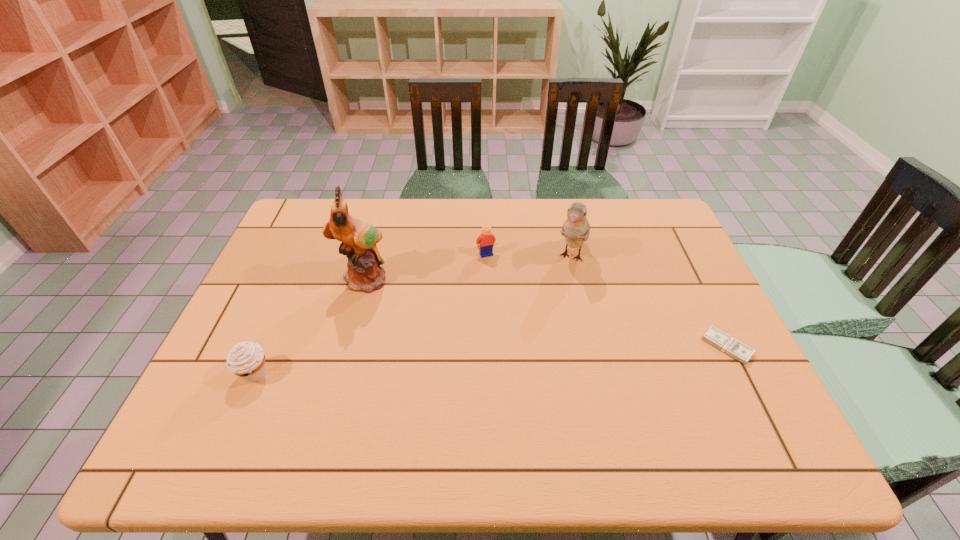
The width and height of the screenshot is (960, 540). I want to click on muffin, so click(x=246, y=359).

Identify the location of money. (739, 351).

Locate an element on the screen. The width and height of the screenshot is (960, 540). the rightmost object is located at coordinates (739, 351).

Image resolution: width=960 pixels, height=540 pixels. I want to click on the fourth object from right to left, so click(358, 238).

Where is `parrot`? parrot is located at coordinates (358, 238).

The image size is (960, 540). In order to click on bird in this screenshot , I will do `click(576, 229)`.

Locate an element on the screen. This screenshot has height=540, width=960. the second tallest object is located at coordinates (576, 229).

Where is `the third object from right to left`? The height and width of the screenshot is (540, 960). the third object from right to left is located at coordinates (486, 239).

Locate an element on the screen. This screenshot has height=540, width=960. free space located on the right of the leftmost object is located at coordinates [x=322, y=375].

Identify the location of vacant space located on the left of the shortest object. The image size is (960, 540). (551, 347).